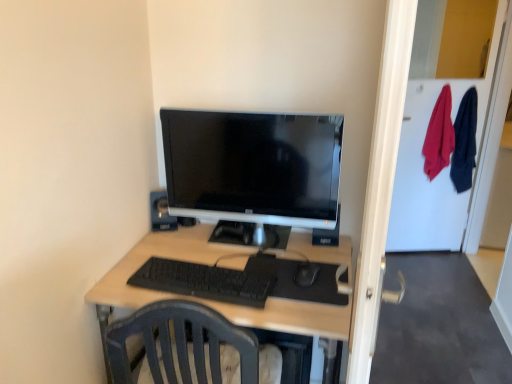
Question: In terms of height, does black matte keyboard at center look taller or shorter compared to transparent glass door at right?

Choices:
 (A) tall
 (B) short

Answer: (B)

Question: From a real-world perspective, is black matte keyboard at center positioned above or below transparent glass door at right?

Choices:
 (A) below
 (B) above

Answer: (A)

Question: Which of these objects is positioned closest to the black plastic mouse at center?

Choices:
 (A) transparent glass door at right
 (B) black plastic speaker at upper center
 (C) satin black monitor at center
 (D) black matte keyboard at center
 (E) light wood desk at center

Answer: (D)

Question: Which of these objects is positioned farthest from the black plastic mouse at center?

Choices:
 (A) black plastic speaker at upper center
 (B) light wood desk at center
 (C) satin black monitor at center
 (D) black matte keyboard at center
 (E) transparent glass door at right

Answer: (E)